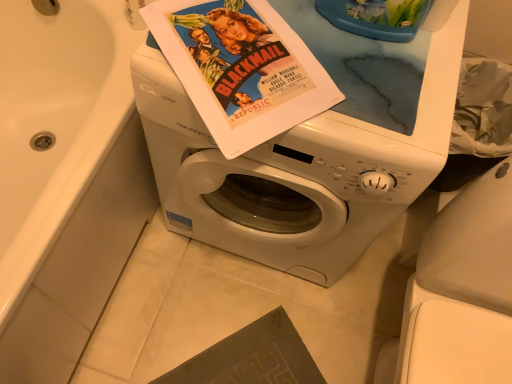
What do you see at coordinates (311, 148) in the screenshot? The height and width of the screenshot is (384, 512). I see `white glossy washing machine at center` at bounding box center [311, 148].

The image size is (512, 384). Find the location of `white glossy washing machine at center`. white glossy washing machine at center is located at coordinates (311, 148).

At what (x,y) coordinates should I click in order to perform the action: click on matte paper movie poster at center. Please return your answer as a coordinate pair (x, y). The height and width of the screenshot is (384, 512). Looking at the image, I should click on (241, 68).

Which point is more distant from viewer, (226, 19) or (414, 150)?

Positioned behind is point (226, 19).

Based on the photo, from the image's perspective, between matte paper movie poster at center and white glossy washing machine at center, who is located below?

white glossy washing machine at center appears lower in the image.

From a real-world perspective, which is physically above, matte paper movie poster at center or white glossy washing machine at center?

In real-world perspective, matte paper movie poster at center is above.

Would you say white glossy washing machine at center is part of matte paper movie poster at center's contents?

No, matte paper movie poster at center does not contain white glossy washing machine at center.

Which is in front, point (42, 203) or point (376, 86)?

The point (376, 86) is more forward.

Is white glossy bathtub at upper left facing towards white glossy washing machine at center?

Yes, white glossy bathtub at upper left faces towards white glossy washing machine at center.

Is white glossy bathtub at upper left not near white glossy washing machine at center?

Actually, white glossy bathtub at upper left and white glossy washing machine at center are a little close together.

Is white glossy bathtub at upper left outside of white glossy washing machine at center?

That's correct, white glossy bathtub at upper left is outside of white glossy washing machine at center.

From a real-world perspective, relative to matte paper movie poster at center, is white glossy bathtub at upper left vertically above or below?

Clearly, from a real-world perspective, white glossy bathtub at upper left is below matte paper movie poster at center.

Can you confirm if white glossy bathtub at upper left is positioned to the left of matte paper movie poster at center?

Indeed, white glossy bathtub at upper left is positioned on the left side of matte paper movie poster at center.

Between point (81, 173) and point (192, 94), which one is positioned in front?

The point (192, 94) is closer.

Can you confirm if white glossy bathtub at upper left is wider than matte paper movie poster at center?

Correct, the width of white glossy bathtub at upper left exceeds that of matte paper movie poster at center.

Is there a large distance between matte paper movie poster at center and white glossy bathtub at upper left?

matte paper movie poster at center is near white glossy bathtub at upper left, not far away.

From the image's perspective, is matte paper movie poster at center above or below white glossy bathtub at upper left?

matte paper movie poster at center is situated higher than white glossy bathtub at upper left in the image.

Which of these two, matte paper movie poster at center or white glossy bathtub at upper left, is thinner?

Thinner between the two is matte paper movie poster at center.

This screenshot has height=384, width=512. I want to click on bath below the matte paper movie poster at center (from the image's perspective), so click(x=65, y=179).

From the picture: Is white glossy washing machine at center smaller than white glossy bathtub at upper left?

Correct, white glossy washing machine at center occupies less space than white glossy bathtub at upper left.

Considering the relative sizes of white glossy washing machine at center and white glossy bathtub at upper left in the image provided, is white glossy washing machine at center wider than white glossy bathtub at upper left?

No, white glossy washing machine at center is not wider than white glossy bathtub at upper left.

Is white glossy washing machine at center looking in the opposite direction of white glossy bathtub at upper left?

white glossy washing machine at center does not have its back to white glossy bathtub at upper left.

How many degrees apart are the facing directions of white glossy washing machine at center and white glossy bathtub at upper left?

There is a 90-degree angle between the facing directions of white glossy washing machine at center and white glossy bathtub at upper left.

Considering the relative sizes of white glossy washing machine at center and matte paper movie poster at center in the image provided, is white glossy washing machine at center thinner than matte paper movie poster at center?

No.

Is point (285, 193) farther from camera compared to point (212, 62)?

Yes.

Is white glossy washing machine at center next to matte paper movie poster at center?

No, white glossy washing machine at center is not touching matte paper movie poster at center.

From the image's perspective, is white glossy washing machine at center above or below matte paper movie poster at center?

white glossy washing machine at center is situated lower than matte paper movie poster at center in the image.

I want to click on paperback book behind the white glossy washing machine at center, so pyautogui.click(x=241, y=68).

Locate an element on the screen. This screenshot has height=384, width=512. washing machine below the white glossy bathtub at upper left (from the image's perspective) is located at coordinates (311, 148).

Which object lies nearer to the anchor point white glossy washing machine at center, white glossy bathtub at upper left or matte paper movie poster at center?

Based on the image, matte paper movie poster at center appears to be nearer to white glossy washing machine at center.

Estimate the real-world distances between objects in this image. Which object is closer to white glossy washing machine at center, matte paper movie poster at center or white glossy bathtub at upper left?

matte paper movie poster at center is positioned closer to the anchor white glossy washing machine at center.

Considering their positions, is white glossy washing machine at center positioned closer to white glossy bathtub at upper left than matte paper movie poster at center?

white glossy washing machine at center is closer to white glossy bathtub at upper left.

Based on their spatial positions, is white glossy washing machine at center or white glossy bathtub at upper left closer to matte paper movie poster at center?

Based on the image, white glossy washing machine at center appears to be nearer to matte paper movie poster at center.

Looking at the image, which one is located closer to matte paper movie poster at center, white glossy bathtub at upper left or white glossy washing machine at center?

Based on the image, white glossy washing machine at center appears to be nearer to matte paper movie poster at center.

From the picture: Estimate the real-world distances between objects in this image. Which object is further from white glossy bathtub at upper left, matte paper movie poster at center or white glossy washing machine at center?

The object further to white glossy bathtub at upper left is matte paper movie poster at center.

Locate an element on the screen. The width and height of the screenshot is (512, 384). paperback book between white glossy bathtub at upper left and white glossy washing machine at center in the horizontal direction is located at coordinates (241, 68).